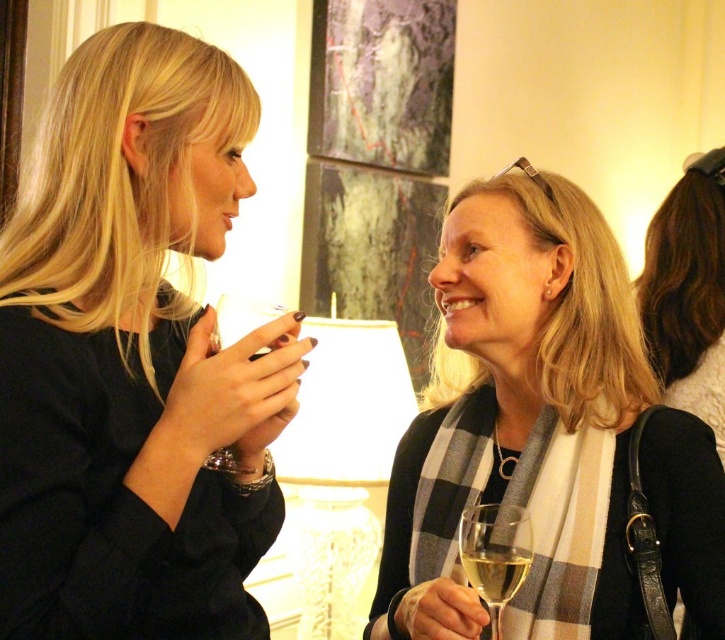
You are taking a photo of the two women in the scene. You want to focus on the point closer to the camera. Which point should you choose between point (x=476, y=536) and point (x=220, y=330)?

Point (x=220, y=330) is closer to the camera than point (x=476, y=536), so you should focus on point (x=220, y=330).

You are attending a party and see two items in the image. The first is a matte black dress at left, and the second is a black leather bag at right. Which item is taller?

The matte black dress at left is much taller as the black leather bag at right.